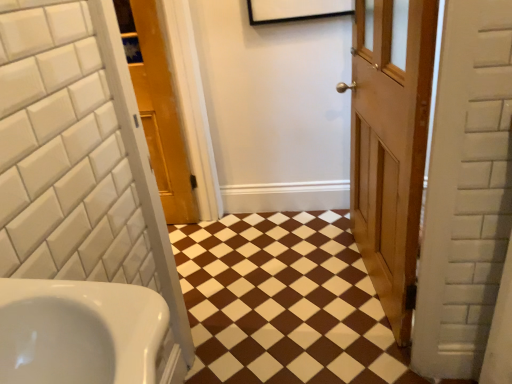
Question: Does wooden door at center, the 1th door from the left, have a greater height compared to white glossy sink at lower left?

Choices:
 (A) no
 (B) yes

Answer: (B)

Question: Does wooden door at center, the 1th door from the left, touch white glossy sink at lower left?

Choices:
 (A) yes
 (B) no

Answer: (B)

Question: Does wooden door at center, which ranks as the second door in right-to-left order, have a larger size compared to white glossy sink at lower left?

Choices:
 (A) no
 (B) yes

Answer: (B)

Question: Can you confirm if wooden door at center, the 1th door from the left, is thinner than white glossy sink at lower left?

Choices:
 (A) no
 (B) yes

Answer: (B)

Question: Is wooden door at center, the 1th door from the left, turned away from white glossy sink at lower left?

Choices:
 (A) no
 (B) yes

Answer: (A)

Question: Is brown glossy tile at center wider or thinner than wooden door at center, the 1th door when ordered from right to left?

Choices:
 (A) thin
 (B) wide

Answer: (B)

Question: Is brown glossy tile at center situated inside wooden door at center, the 1th door when ordered from right to left, or outside?

Choices:
 (A) outside
 (B) inside

Answer: (A)

Question: From the image's perspective, is brown glossy tile at center above or below wooden door at center, which ranks as the 2th door in left-to-right order?

Choices:
 (A) above
 (B) below

Answer: (B)

Question: From a real-world perspective, is brown glossy tile at center physically located above or below wooden door at center, which ranks as the 2th door in left-to-right order?

Choices:
 (A) below
 (B) above

Answer: (A)

Question: Is brown glossy tile at center taller or shorter than wooden door at center, the 1th door from the left?

Choices:
 (A) short
 (B) tall

Answer: (A)

Question: In terms of size, does brown glossy tile at center appear bigger or smaller than wooden door at center, which ranks as the second door in right-to-left order?

Choices:
 (A) small
 (B) big

Answer: (A)

Question: Does point (282, 281) appear closer or farther from the camera than point (163, 185)?

Choices:
 (A) closer
 (B) farther

Answer: (A)

Question: From the image's perspective, is brown glossy tile at center positioned above or below wooden door at center, the 1th door from the left?

Choices:
 (A) above
 (B) below

Answer: (B)

Question: From the image's perspective, is brown glossy tile at center located above or below white glossy sink at lower left?

Choices:
 (A) above
 (B) below

Answer: (B)

Question: Considering the positions of brown glossy tile at center and white glossy sink at lower left in the image, is brown glossy tile at center bigger or smaller than white glossy sink at lower left?

Choices:
 (A) big
 (B) small

Answer: (A)